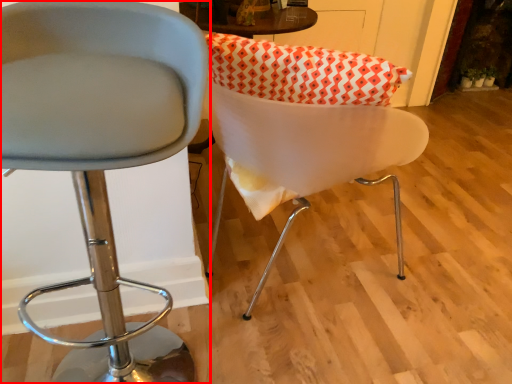
Question: From the image's perspective, where is chair (annotated by the red box) located in relation to chair in the image?

Choices:
 (A) below
 (B) above

Answer: (A)